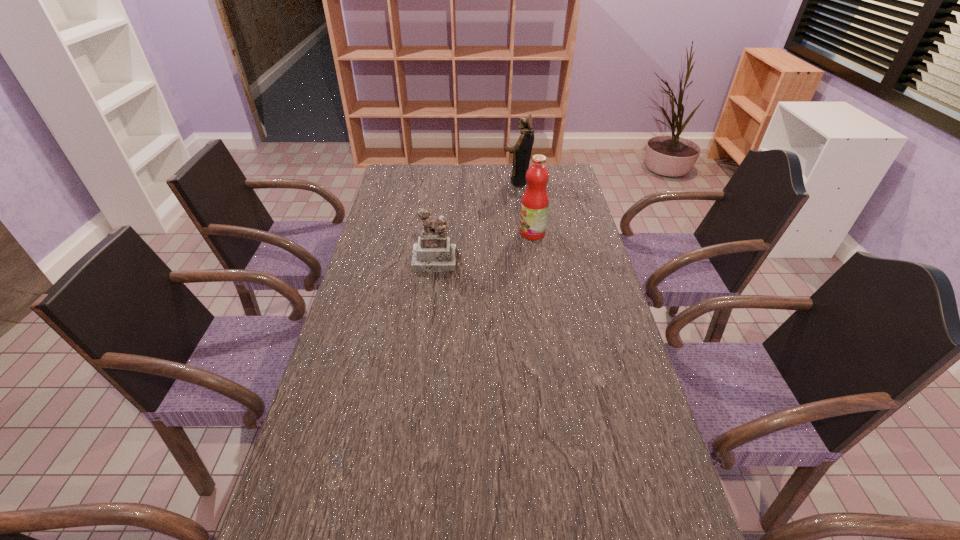
Locate an element on the screen. Image resolution: width=960 pixels, height=540 pixels. the farthest object is located at coordinates (522, 149).

You are a GUI agent. You are given a task and a screenshot of the screen. Output one action in this format:
    pyautogui.click(x=<x>, y=<y>)
    Task: Click on the taller figurine
    This screenshot has height=540, width=960.
    Given the screenshot: What is the action you would take?
    pyautogui.click(x=522, y=149)

This screenshot has width=960, height=540. Identify the location of fruit juice. (534, 206).

This screenshot has height=540, width=960. In order to click on the left figurine in this screenshot , I will do `click(434, 252)`.

Where is `the nearest object`? the nearest object is located at coordinates (434, 252).

Identify the location of vacant space located 0.310m on the front-facing side of the right figurine. The image size is (960, 540). (430, 182).

Find the location of a particular element. free space located on the front-facing side of the right figurine is located at coordinates (444, 182).

Where is `free space located on the front-facing side of the right figurine`? The height and width of the screenshot is (540, 960). free space located on the front-facing side of the right figurine is located at coordinates (461, 182).

What are the coordinates of `vacant space located on the front label of the second farthest object` in the screenshot? It's located at (444, 233).

You are a GUI agent. You are given a task and a screenshot of the screen. Output one action in this format:
    pyautogui.click(x=<x>, y=<y>)
    Task: Click on the vacant space located on the front label of the second farthest object
    Image resolution: width=960 pixels, height=540 pixels.
    Given the screenshot: What is the action you would take?
    pyautogui.click(x=486, y=233)